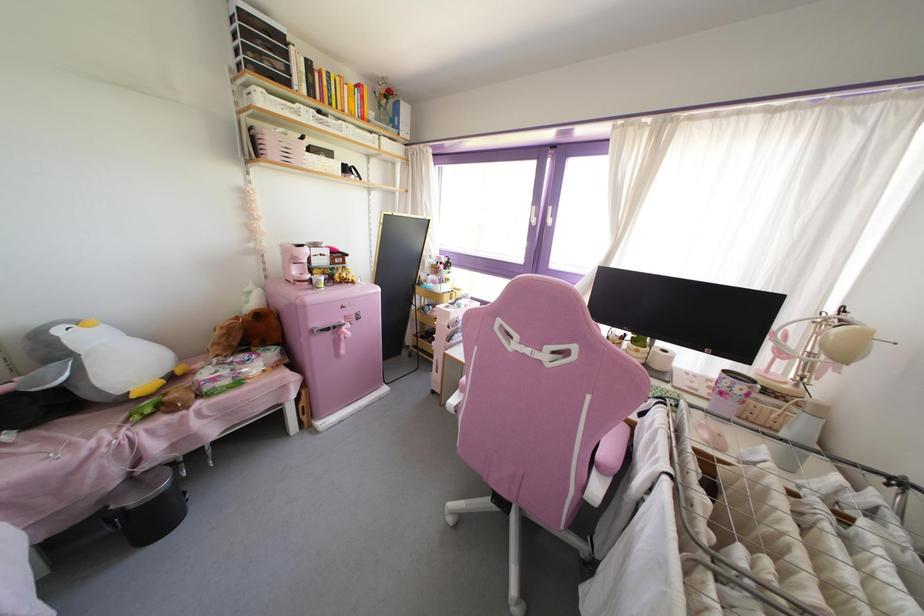
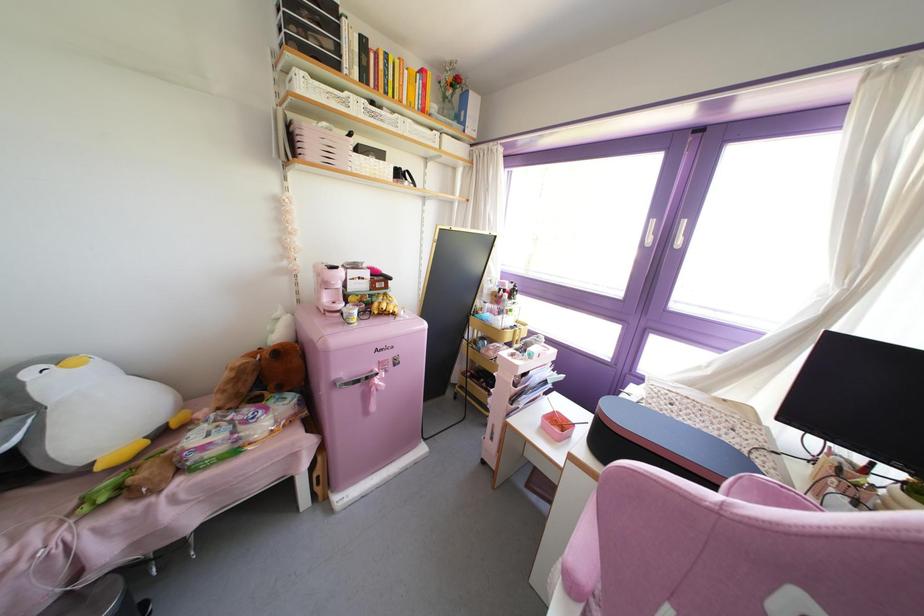
Locate, in the second image, the point that corresponds to the point at 322,158 in the first image.

(371, 160)